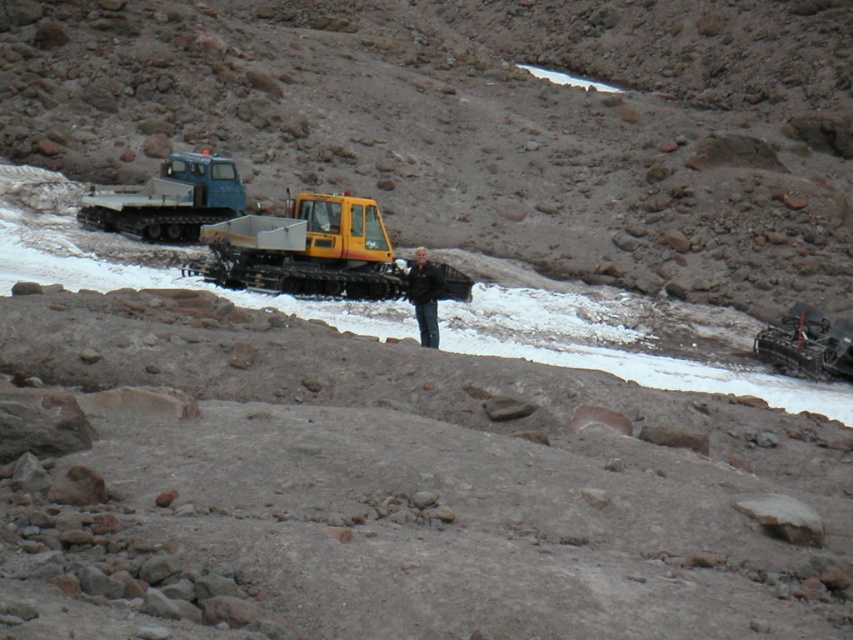
Question: Can you confirm if blue rubber tracked vehicle at left is positioned to the left of metallic silver snowplow at lower right?

Choices:
 (A) yes
 (B) no

Answer: (A)

Question: Which point is farther from the camera taking this photo?

Choices:
 (A) (817, 342)
 (B) (645, 93)
 (C) (212, 241)

Answer: (B)

Question: Is yellow rubber tracked vehicle at center smaller than metallic silver snowplow at lower right?

Choices:
 (A) no
 (B) yes

Answer: (A)

Question: Does blue rubber tracked vehicle at left appear under metallic silver snowplow at lower right?

Choices:
 (A) no
 (B) yes

Answer: (A)

Question: Which object is positioned farthest from the yellow rubber tracked vehicle at center?

Choices:
 (A) metallic silver snowplow at lower right
 (B) blue rubber tracked vehicle at left

Answer: (A)

Question: Which of the following is the farthest from the observer?

Choices:
 (A) blue rubber tracked vehicle at left
 (B) black matte jacket at center
 (C) rocky dirt at center
 (D) yellow rubber tracked vehicle at center

Answer: (C)